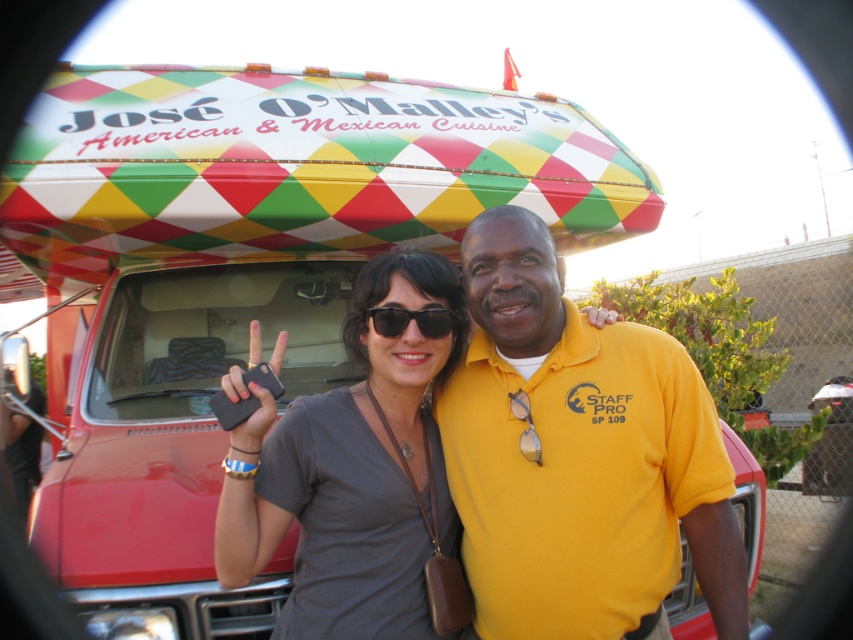
You are a photographer trying to capture a closeup of the gray matte shirt at center and the black plastic sunglasses at center for a fashion magazine. The magazine requires that the two items must be within 30 centimeters of each other in the photo. Based on the scene, can you achieve this requirement?

The gray matte shirt at center and black plastic sunglasses at center are 31.43 centimeters apart from each other, which is slightly over the 30 centimeter requirement. Therefore, the photographer cannot meet the magazine requirement as the distance exceeds the limit.

You are a photographer trying to capture a group photo of the two people in front of the food truck. You want to ensure that both the yellow cotton polo shirt at center and the gray matte shirt at center are clearly visible in the frame. Based on their positions, which shirt might require you to adjust your camera angle to avoid being obscured?

The yellow cotton polo shirt at center might be wider than the gray matte shirt at center, so you might need to adjust the camera angle to ensure both shirts are fully visible without overlapping.

You are a photographer taking a picture of the gray matte shirt at center and the black plastic sunglasses at center. Which object should you focus on first if you want to capture both clearly in the same frame?

You should focus on the gray matte shirt at center first because it is larger than the black plastic sunglasses at center, allowing for better depth of field coverage.